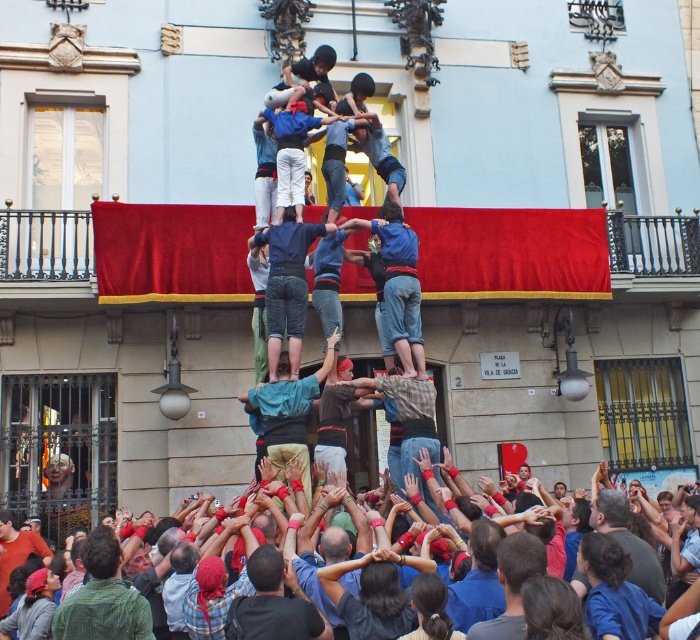
Question: Is plaid shirt at center below red fabric crowd at center?

Choices:
 (A) yes
 (B) no

Answer: (B)

Question: Which of the following is the farthest from the observer?

Choices:
 (A) (94, 579)
 (B) (302, 132)
 (C) (650, 595)
 (D) (258, 614)

Answer: (B)

Question: Does blue denim pants at center have a lesser width compared to red fabric crowd at center?

Choices:
 (A) yes
 (B) no

Answer: (A)

Question: Which of the following is the farthest from the observer?

Choices:
 (A) plaid shirt at center
 (B) light blue denim shirt at center
 (C) green plaid shirt at lower left
 (D) blue denim jeans at center

Answer: (D)

Question: Which of the following is the farthest from the observer?

Choices:
 (A) light blue denim shirt at center
 (B) plaid shirt at center
 (C) red fabric crowd at center
 (D) blue denim jeans at center

Answer: (D)

Question: Is green plaid shirt at lower left above dark blue shirt at center?

Choices:
 (A) yes
 (B) no

Answer: (B)